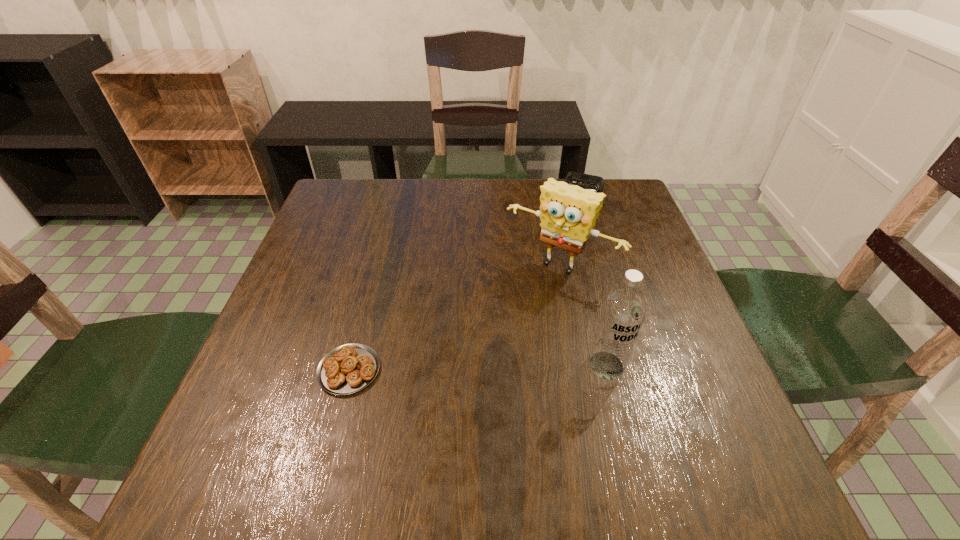
Locate an element on the screen. the leftmost object is located at coordinates (349, 368).

Identify the location of vodka. (623, 311).

Image resolution: width=960 pixels, height=540 pixels. Identify the location of the farthest object. (585, 181).

Identify the location of the second farthest object. The height and width of the screenshot is (540, 960). (567, 212).

The height and width of the screenshot is (540, 960). In order to click on vacant area located on the front of the pastry in this screenshot , I will do `click(334, 428)`.

The image size is (960, 540). What are the coordinates of `vacant space located on the display of the alarm clock` in the screenshot? It's located at coord(557,248).

What are the coordinates of `vacant area located on the display of the alarm clock` in the screenshot? It's located at (571, 213).

Locate an element on the screen. vacant area situated 0.160m on the display of the alarm clock is located at coordinates (565, 227).

Locate an element on the screen. vacant space located 0.140m on the face of the sponge is located at coordinates (505, 326).

Find the location of a particular element. This screenshot has height=540, width=960. vacant space located on the face of the sponge is located at coordinates (475, 366).